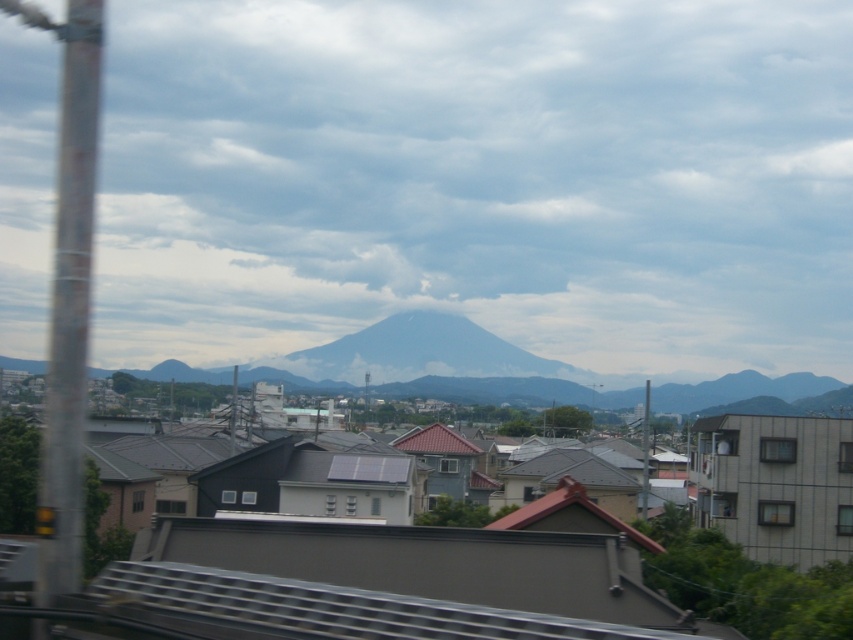
Question: Is white snow-covered mountain at center to the right of metallic pole at right from the viewer's perspective?

Choices:
 (A) yes
 (B) no

Answer: (B)

Question: Is white snow-covered mountain at center to the right of metallic pole at right from the viewer's perspective?

Choices:
 (A) no
 (B) yes

Answer: (A)

Question: Does cloudy sky at center have a smaller size compared to metallic pole at right?

Choices:
 (A) yes
 (B) no

Answer: (B)

Question: Estimate the real-world distances between objects in this image. Which object is closer to the metallic pole at center?

Choices:
 (A) cloudy sky at center
 (B) white snow-capped mountain at center
 (C) metallic gray pole at left

Answer: (C)

Question: Which object is the closest to the metallic pole at right?

Choices:
 (A) white snow-covered mountain at center
 (B) white snow-capped mountain at center

Answer: (A)

Question: Which is farther from the metallic pole at right?

Choices:
 (A) white snow-capped mountain at center
 (B) cloudy sky at center
 (C) metallic gray pole at left

Answer: (B)